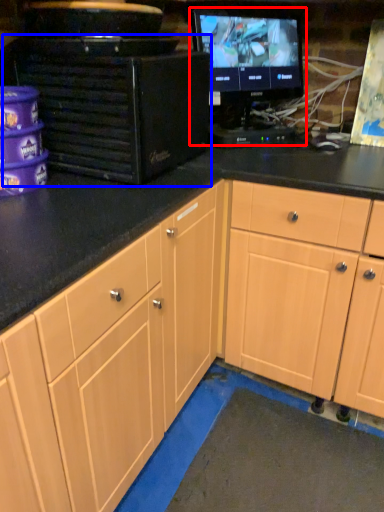
Question: Among these objects, which one is nearest to the camera, computer monitor (highlighted by a red box) or desktop computer (highlighted by a blue box)?

Choices:
 (A) computer monitor
 (B) desktop computer

Answer: (B)